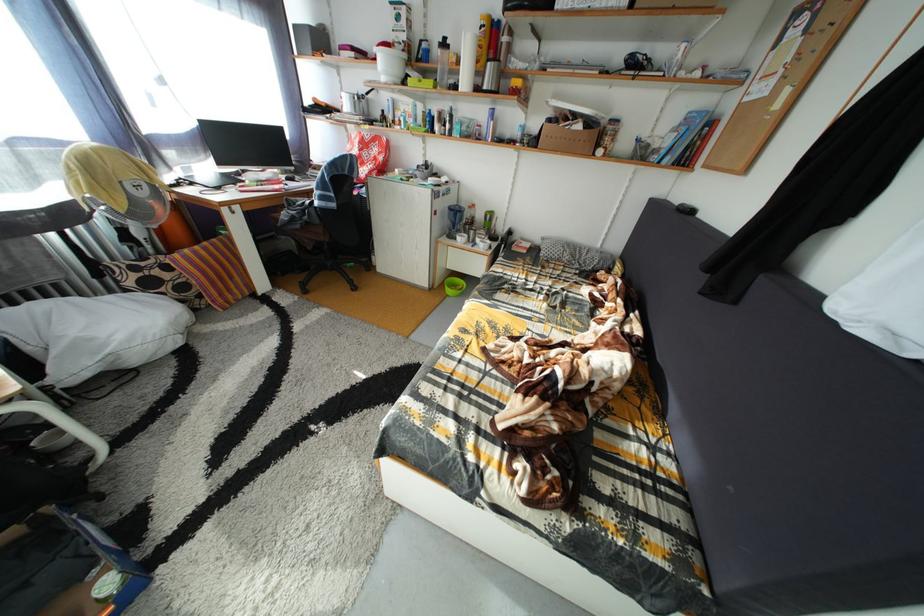
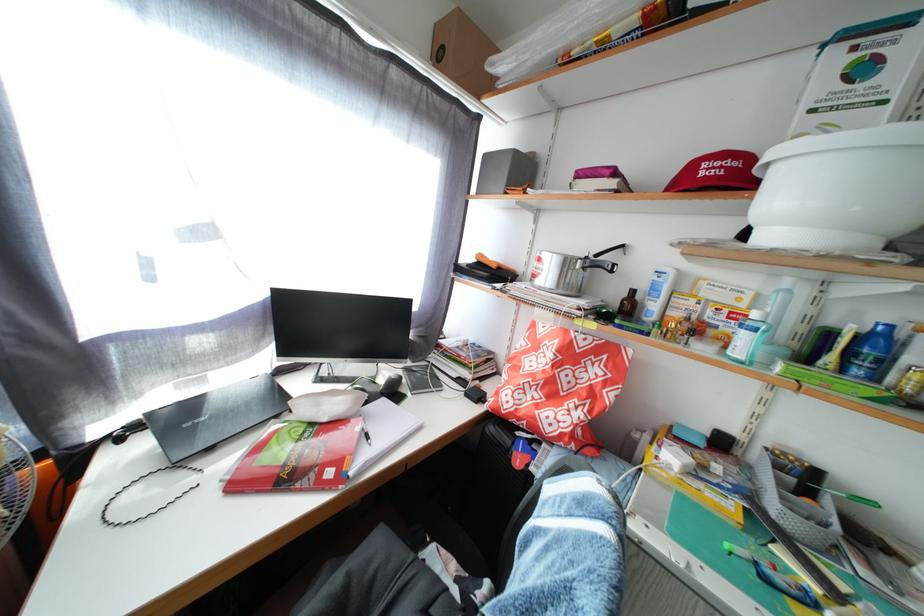
Question: I am providing you with two images of the same scene from different viewpoints. Please identify which objects are invisible in image2.

Choices:
 (A) blue plastic bottle
 (B) orange tool handle
 (C) small brown bottle
 (D) none of these

Answer: (D)